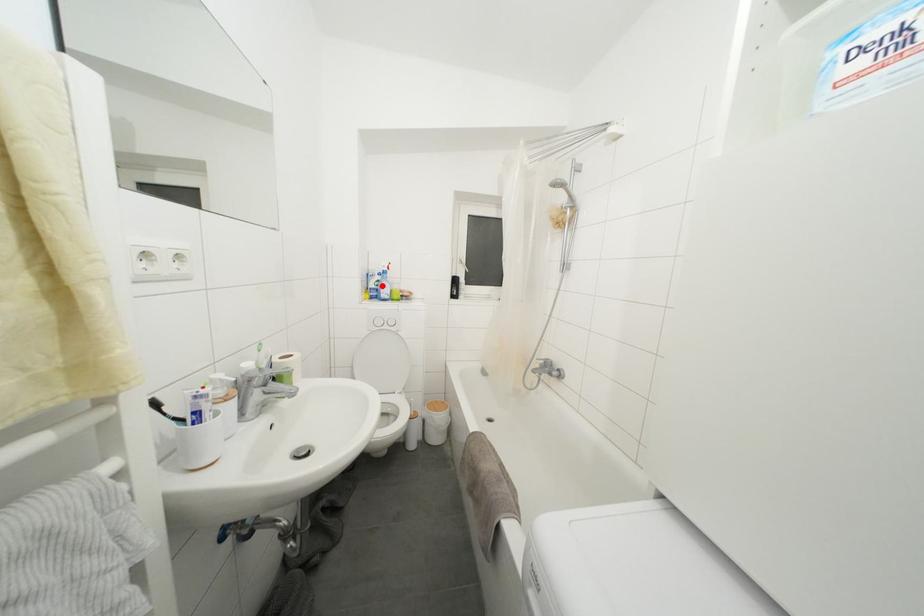
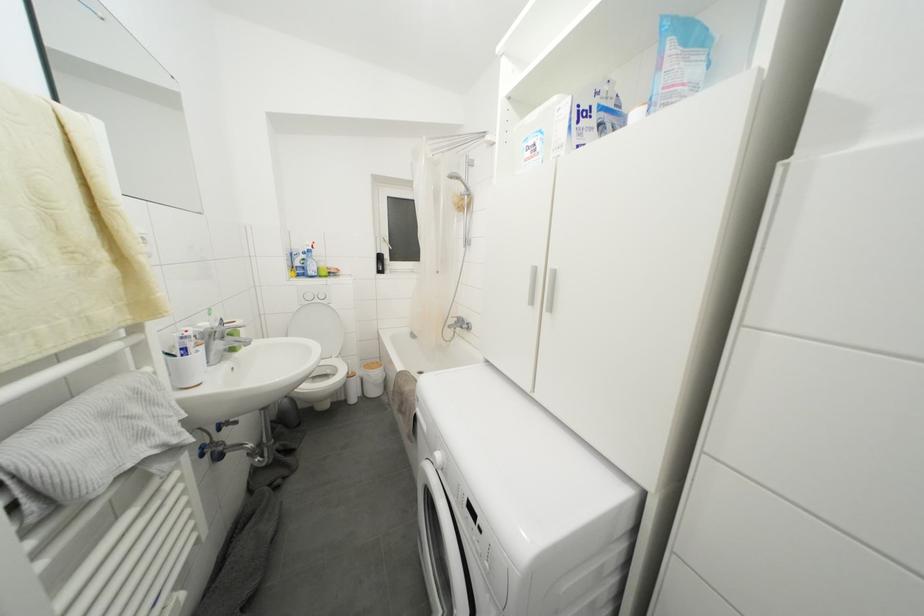
Question: I am providing you with two images of the same scene from different viewpoints. A red point is marked on the first image. Can you still see the location of the red point in image 2?

Choices:
 (A) Yes
 (B) No

Answer: (A)